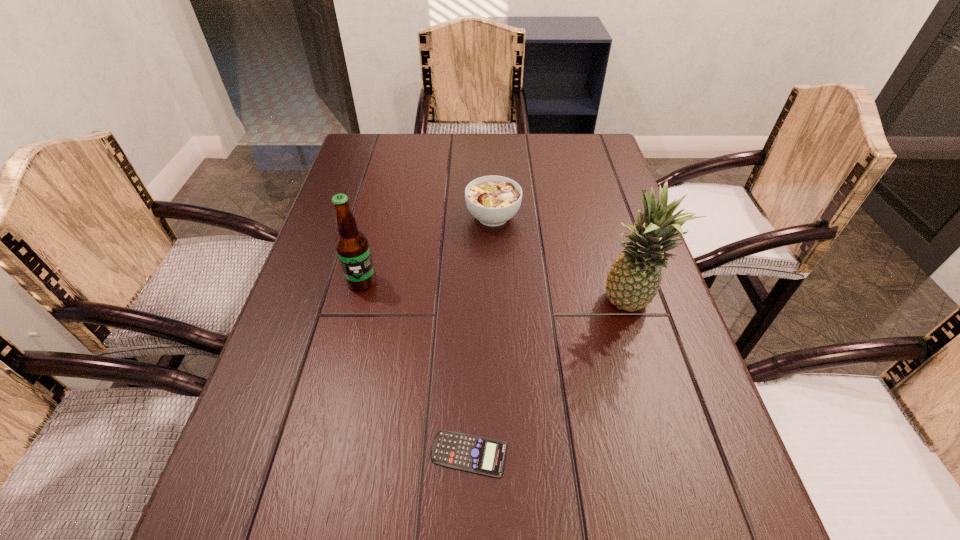
You are a GUI agent. You are given a task and a screenshot of the screen. Output one action in this format:
    pyautogui.click(x=<x>, y=<y>)
    Task: Click on the blank area located on the front of the soup bowl
    Image resolution: width=960 pixels, height=540 pixels.
    Given the screenshot: What is the action you would take?
    pyautogui.click(x=496, y=312)

Where is `vacant space located on the left of the nearest object`? vacant space located on the left of the nearest object is located at coordinates (248, 454).

At what (x,y) coordinates should I click in order to perform the action: click on object at the left edge. Please return your answer as a coordinate pair (x, y). The width and height of the screenshot is (960, 540). Looking at the image, I should click on click(352, 246).

Identify the location of object located at the right edge. (634, 279).

The image size is (960, 540). In the image, there is a desktop. In order to click on vacant space at the far edge in this screenshot , I will do `click(402, 151)`.

The width and height of the screenshot is (960, 540). What are the coordinates of `vacant space at the left edge of the desktop` in the screenshot? It's located at 357,196.

Where is `free space at the right edge`? free space at the right edge is located at coordinates click(x=702, y=494).

You are a GUI agent. You are given a task and a screenshot of the screen. Output one action in this format:
    pyautogui.click(x=<x>, y=<y>)
    Task: Click on the unoccupied position between the tallest object and the beer bottle
    Image resolution: width=960 pixels, height=540 pixels.
    Given the screenshot: What is the action you would take?
    pyautogui.click(x=495, y=293)

The height and width of the screenshot is (540, 960). Find the location of `free space between the pineapple and the soup bowl`. free space between the pineapple and the soup bowl is located at coordinates (561, 261).

The image size is (960, 540). In order to click on vacant space that is in between the leftmost object and the tallest object in this screenshot , I will do click(x=495, y=293).